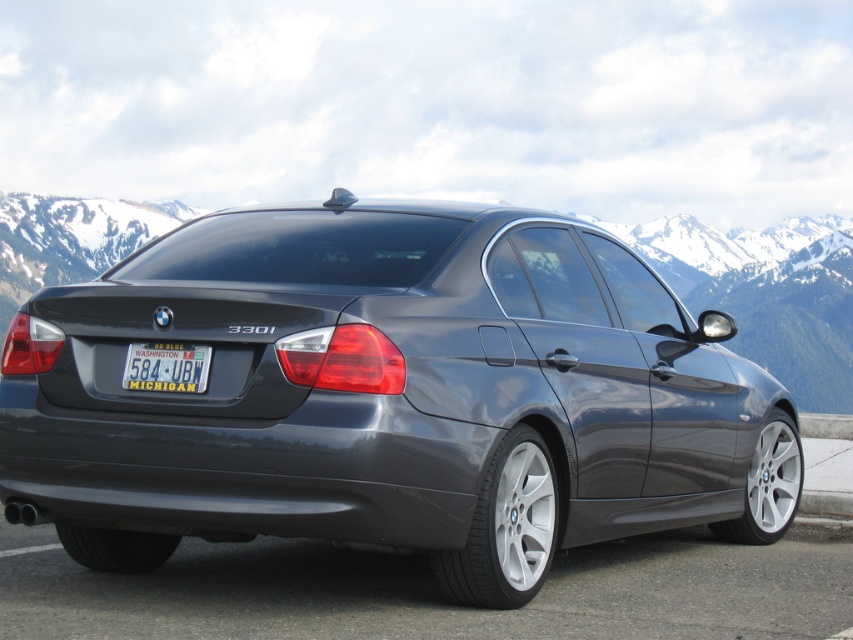
Where is the satin metallic sedan at center located in the image?

The satin metallic sedan at center is located at point (392, 396) in the image.

You are a delivery person who needs to place a rectangular box that is 26 inches long between the satin metallic sedan at center and the yellowtexturedlicense plate at lower center. Can you fit the box between them without bending it?

The satin metallic sedan at center and yellowtexturedlicense plate at lower center are 27.62 inches apart, so yes, the box can fit between them since its length is shorter than the distance between the two objects.

Consider the image. Imagine you are standing at the point marked by the coordinates point (315, 289). You want to take a photo of the BMW 330i sedan from this position. Considering the camera you have can only focus on objects within 10 feet, will you be able to capture a clear photo of the car?

The distance between point (315, 289) and the camera is 11.65 feet. Since the camera can only focus within 10 feet, the car will be out of focus and a clear photo cannot be taken.